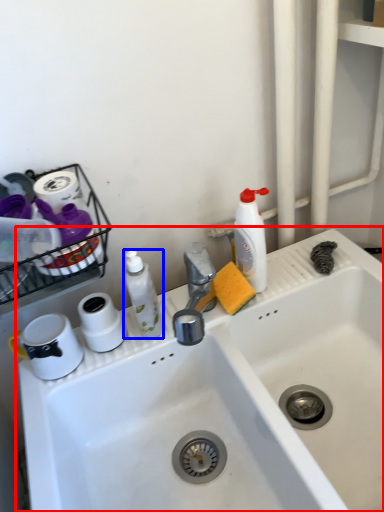
Question: Among these objects, which one is farthest to the camera, sink (highlighted by a red box) or cleaning product (highlighted by a blue box)?

Choices:
 (A) sink
 (B) cleaning product

Answer: (B)